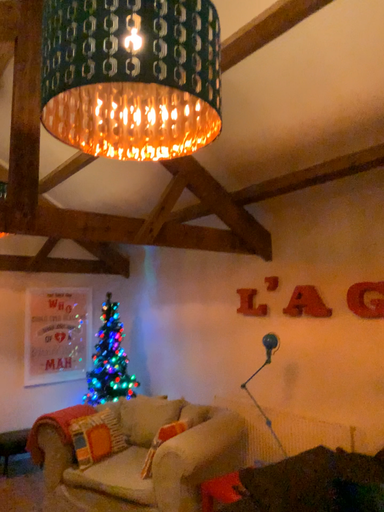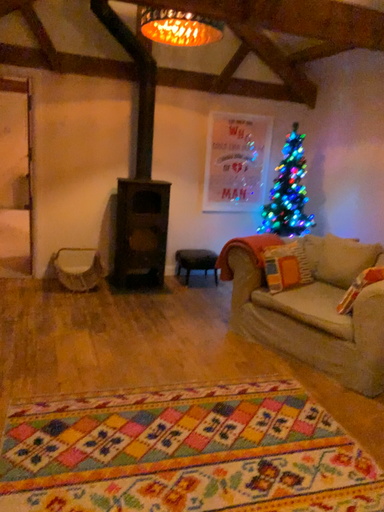
Question: Which way did the camera rotate in the video?

Choices:
 (A) rotated downward
 (B) rotated upward

Answer: (A)